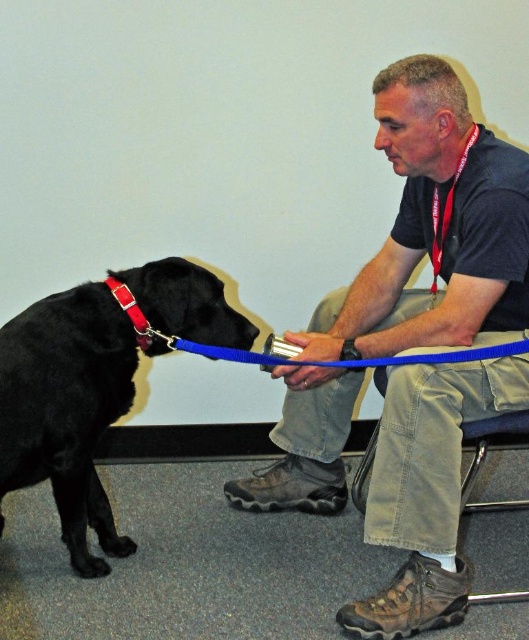
Does matte black shirt at center have a larger size compared to blue rubber leash at center?

Yes.

Between point (402, 141) and point (229, 356), which one is positioned in front?

Point (402, 141)

Who is more forward, (503, 330) or (513, 342)?

Point (513, 342) is in front.

Where is `matte black shirt at center`? matte black shirt at center is located at coordinates (434, 228).

Does black matte dog at left appear on the right side of blue rubber leash at center?

In fact, black matte dog at left is to the left of blue rubber leash at center.

Is black matte dog at left smaller than blue rubber leash at center?

No, black matte dog at left is not smaller than blue rubber leash at center.

Locate an element on the screen. This screenshot has height=640, width=529. black matte dog at left is located at coordinates (67, 408).

The width and height of the screenshot is (529, 640). I want to click on black matte dog at left, so click(x=67, y=408).

Who is positioned more to the left, blue rubber leash at center or red nylon collar at left?

red nylon collar at left

Who is more distant from viewer, (476, 349) or (141, 342)?

Point (141, 342)

The image size is (529, 640). What are the coordinates of `blue rubber leash at center` in the screenshot? It's located at (334, 360).